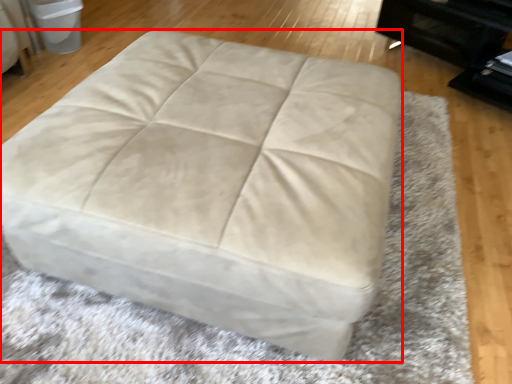
Question: From the image's perspective, what is the correct spatial positioning of furniture (annotated by the red box) in reference to bean bag chair?

Choices:
 (A) below
 (B) above

Answer: (A)